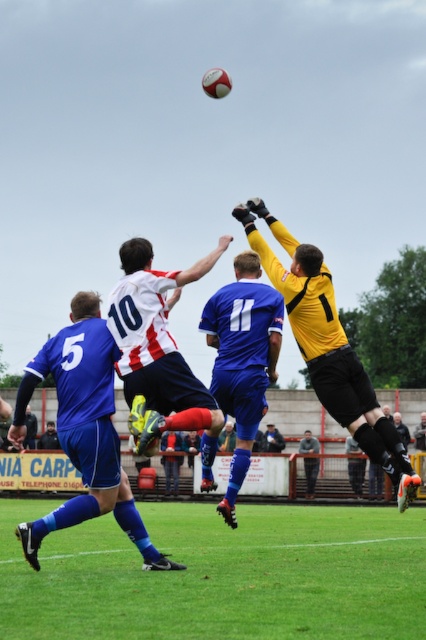
Which of these two, blue jersey at center or gray fabric jacket at center, stands shorter?

With less height is blue jersey at center.

Is blue jersey at center taller than gray fabric jacket at center?

No.

Where is `blue jersey at center`? The height and width of the screenshot is (640, 426). blue jersey at center is located at coordinates (242, 358).

Does green grass at lower center appear under gray fabric jacket at center?

Incorrect, green grass at lower center is not positioned below gray fabric jacket at center.

Consider the image. Between green grass at lower center and gray fabric jacket at center, which one appears on the left side from the viewer's perspective?

green grass at lower center

This screenshot has height=640, width=426. Find the location of `green grass at lower center`. green grass at lower center is located at coordinates (221, 576).

Can you confirm if blue fabric shorts at center is taller than yellow jersey at center?

No.

Who is taller, blue fabric shorts at center or yellow jersey at center?

yellow jersey at center

Is point (80, 378) positioned behind point (313, 380)?

No, (80, 378) is closer to viewer.

Image resolution: width=426 pixels, height=640 pixels. Identify the location of blue fabric shorts at center. (83, 429).